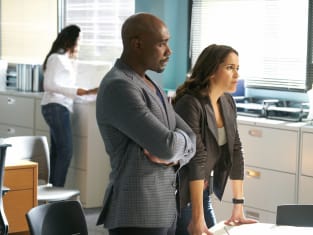
Locate an element on the screen. office setting is located at coordinates (7, 3).